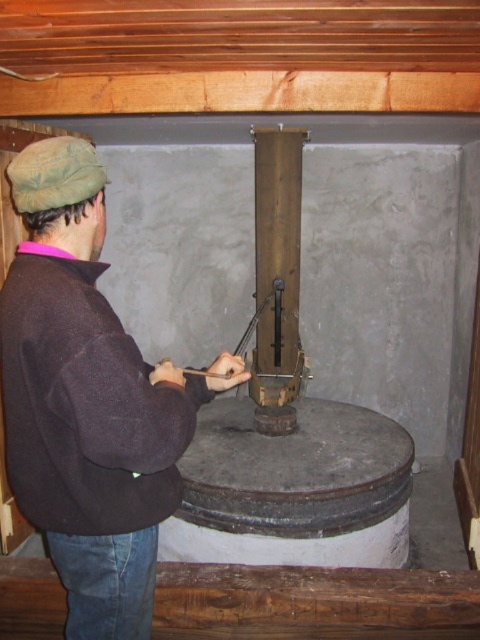
You are a tailor measuring clothes for customers. You see the brown fleece jacket at left and the rusty metal pole at center in the image. Which item requires a larger measurement tape to accurately measure its dimensions?

The brown fleece jacket at left requires a larger measurement tape because it has a larger size compared to the rusty metal pole at center.

You are a tailor measuring garments and tools in a rustic workshop. You have a brown fleece jacket at left and a rusty metal pole at center. Which item is wider?

The brown fleece jacket at left is wider than the rusty metal pole at center since its width surpasses the pole.

You are a visitor in this rustic indoor setting and want to know which object is taller between the brown fleece jacket at left and the rusty metal pole at center. Can you determine this based on their positions?

The brown fleece jacket at left is not as tall as the rusty metal pole at center, so the rusty metal pole at center is taller.